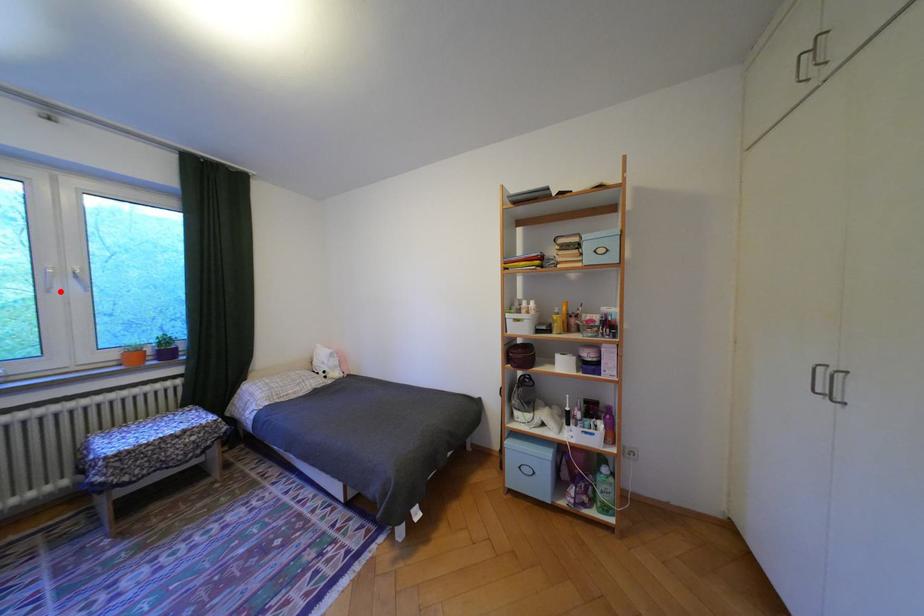
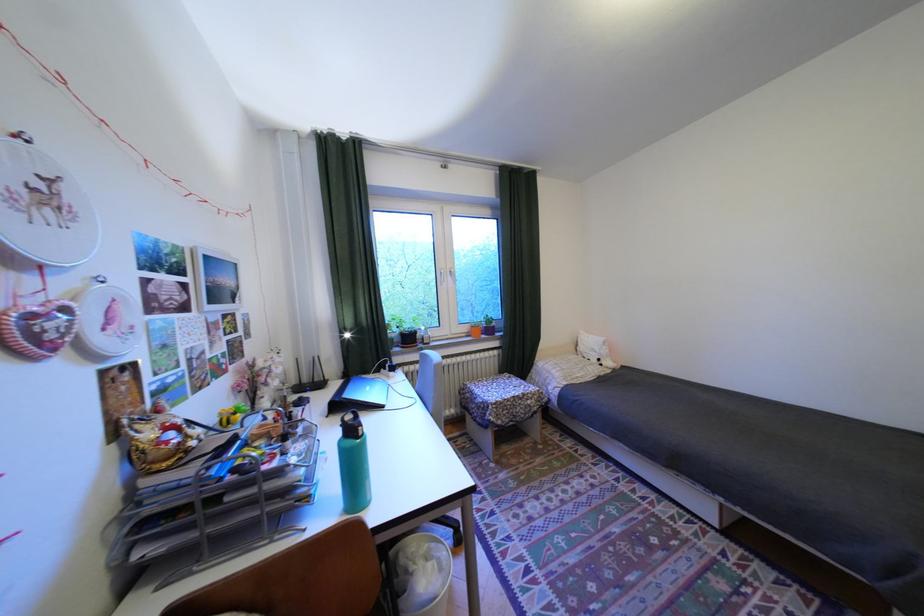
In the second image, find the point that corresponds to the highlighted location in the first image.

(454, 285)